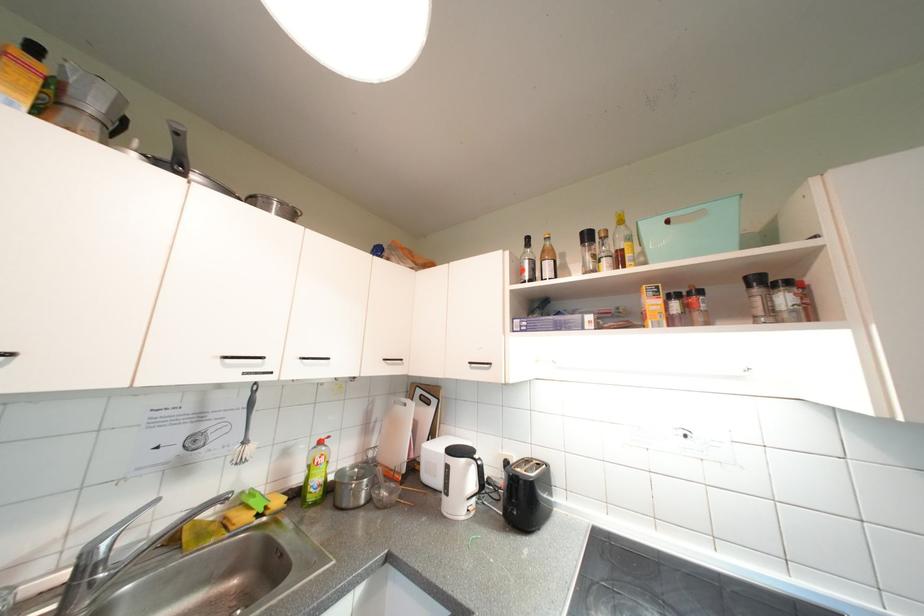
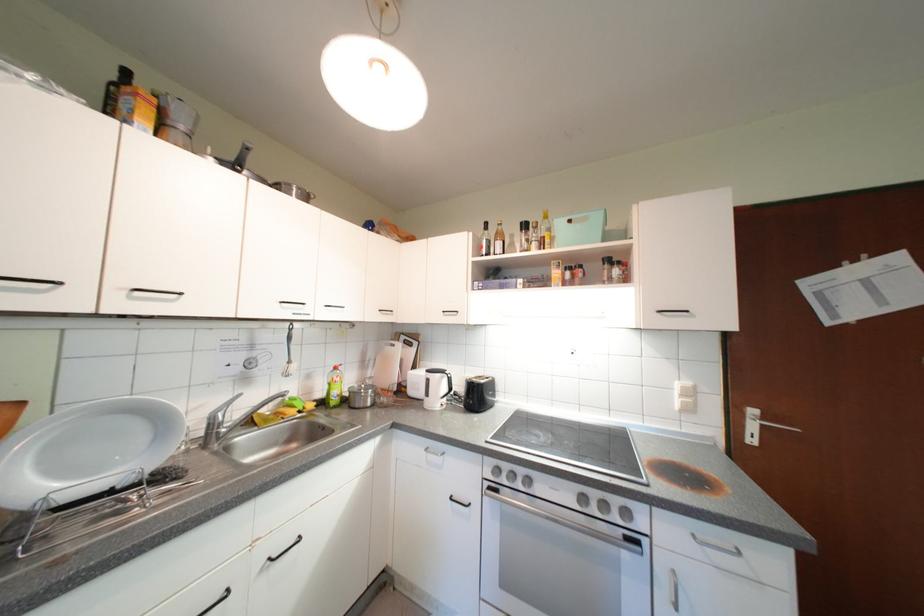
The point at (594,238) is marked in the first image. Where is the corresponding point in the second image?

(532, 228)